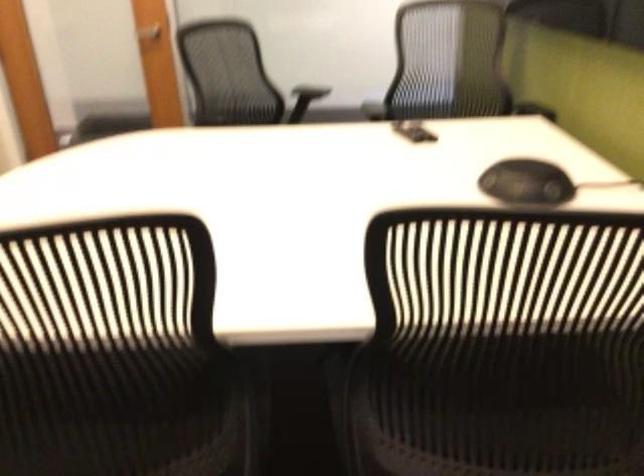
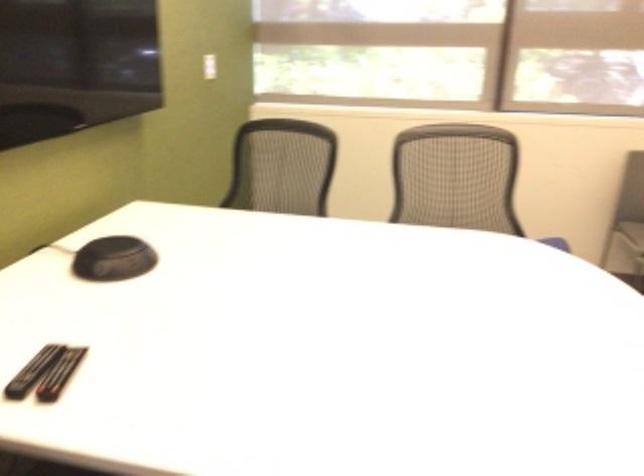
Find the pixel in the second image that matches [424,130] in the first image.

(32, 371)